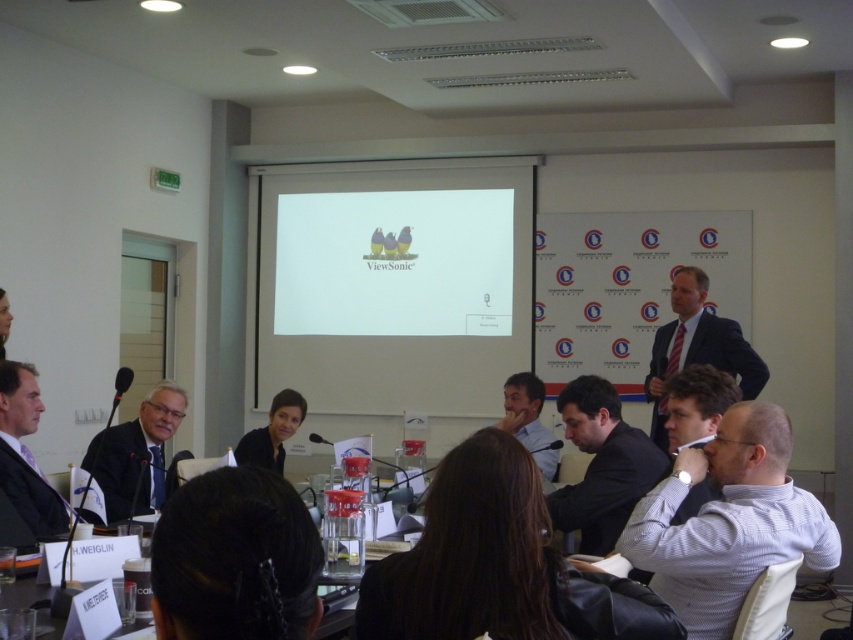
Question: Is dark blue suit at center to the left of black fabric shirt at center from the viewer's perspective?

Choices:
 (A) no
 (B) yes

Answer: (A)

Question: Among these objects, which one is farthest from the camera?

Choices:
 (A) light brown suit at center
 (B) white striped shirt at lower right
 (C) white matte projection screen at center
 (D) black fabric shirt at center

Answer: (C)

Question: Observing the image, what is the correct spatial positioning of dark blue suit at center in reference to dark suit at left?

Choices:
 (A) above
 (B) below

Answer: (A)

Question: Which object is the closest to the dark suit at center?

Choices:
 (A) light brown suit at center
 (B) dark blue suit at center
 (C) white striped shirt at lower right

Answer: (C)

Question: Does white matte projection screen at center have a larger size compared to light brown suit at center?

Choices:
 (A) no
 (B) yes

Answer: (B)

Question: Which of the following is the farthest from the observer?

Choices:
 (A) dark suit at left
 (B) matte black suit at left

Answer: (B)